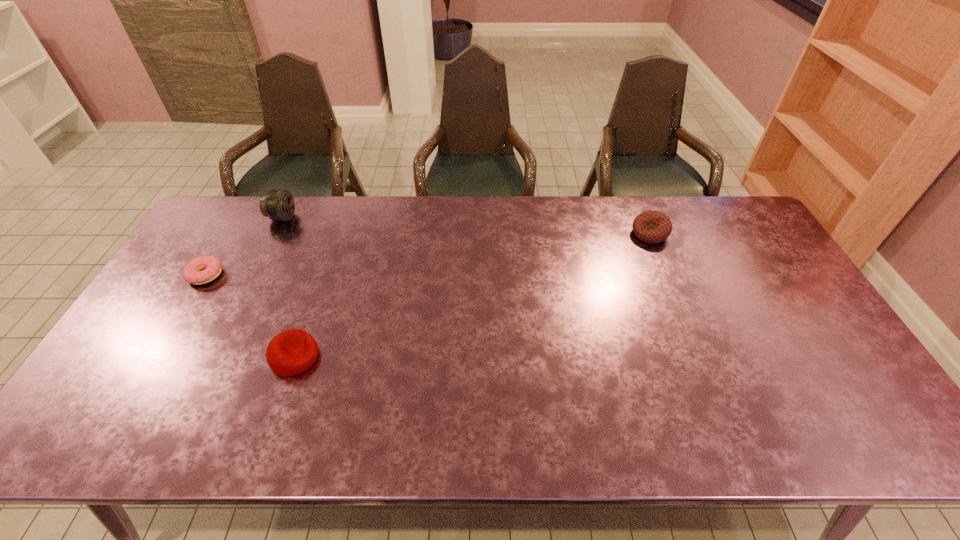
I want to click on vacant space located 0.170m on the seat area of the left beanbag, so click(384, 357).

I want to click on free space located on the front of the second nearest object, so click(x=183, y=312).

You are a GUI agent. You are given a task and a screenshot of the screen. Output one action in this format:
    pyautogui.click(x=<x>, y=<y>)
    Task: Click on the telephoto lens present at the far edge
    
    Given the screenshot: What is the action you would take?
    pyautogui.click(x=278, y=205)

Where is `beanbag located at the far edge`? This screenshot has width=960, height=540. beanbag located at the far edge is located at coordinates (652, 227).

At what (x,y) coordinates should I click in order to perform the action: click on object located in the left edge section of the desktop. Please return your answer as a coordinate pair (x, y). Looking at the image, I should click on (212, 266).

The image size is (960, 540). In the image, there is a desktop. What are the coordinates of `vacant space at the far edge` in the screenshot? It's located at (424, 204).

Locate an element on the screen. The image size is (960, 540). vacant space at the near edge of the desktop is located at coordinates (346, 418).

Locate an element on the screen. free space at the left edge of the desktop is located at coordinates (186, 284).

Identify the location of vacant position at the right edge of the desktop. (767, 303).

Locate an element on the screen. The width and height of the screenshot is (960, 540). vacant region at the far left corner of the desktop is located at coordinates (240, 204).